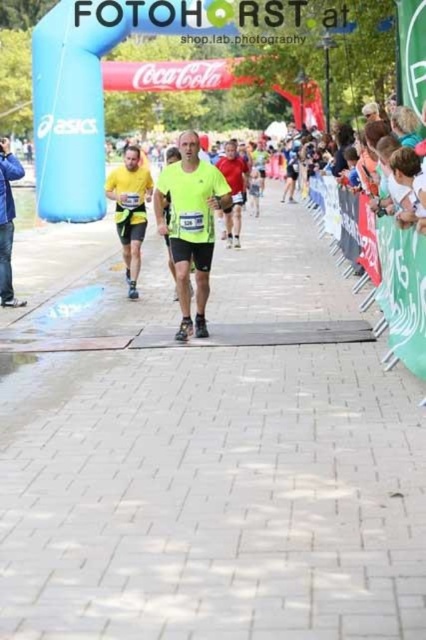
Identify the location of neon yellow running shirt at center. (190, 225).

In the scene shown: Who is shorter, matte blue jacket at left or matte red shirt at center?

With less height is matte red shirt at center.

Between point (2, 188) and point (232, 230), which one is positioned in front?

Point (2, 188)

Which is behind, point (11, 243) or point (235, 211)?

Point (235, 211)

Where is `matte blue jacket at left`? The height and width of the screenshot is (640, 426). matte blue jacket at left is located at coordinates (6, 221).

Between neon yellow running shirt at center and matte red shirt at center, which one is positioned lower?

Positioned lower is neon yellow running shirt at center.

Is neon yellow running shirt at center wider than matte red shirt at center?

Correct, the width of neon yellow running shirt at center exceeds that of matte red shirt at center.

Locate an element on the screen. This screenshot has width=426, height=640. neon yellow running shirt at center is located at coordinates (190, 225).